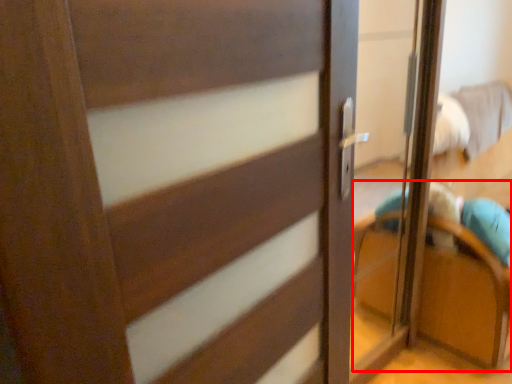
Question: From the image's perspective, what is the correct spatial positioning of armchair (annotated by the red box) in reference to door?

Choices:
 (A) above
 (B) below

Answer: (A)